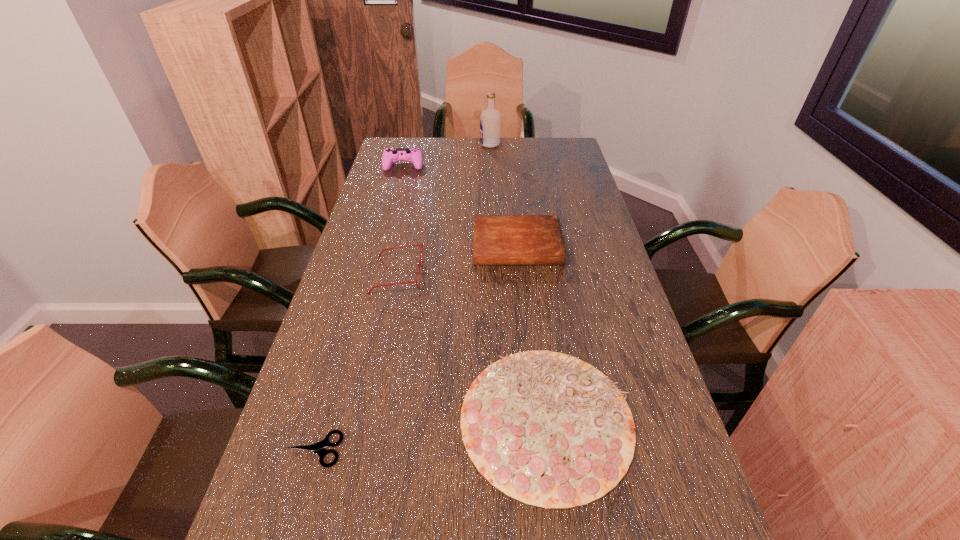
Find the location of `Bible at the right edge`. Bible at the right edge is located at coordinates (498, 239).

The width and height of the screenshot is (960, 540). Find the location of `pizza positioned at the right edge`. pizza positioned at the right edge is located at coordinates (548, 429).

The height and width of the screenshot is (540, 960). In order to click on object present at the far left corner in this screenshot , I will do `click(414, 155)`.

In order to click on vacant space at the far edge of the desktop in this screenshot , I will do `click(487, 149)`.

This screenshot has width=960, height=540. Find the location of `free spot at the left edge of the desktop`. free spot at the left edge of the desktop is located at coordinates (372, 309).

This screenshot has height=540, width=960. In order to click on vacant space at the right edge in this screenshot , I will do `click(569, 272)`.

At what (x,y) coordinates should I click in order to perform the action: click on free space at the far left corner. Please return your answer as a coordinate pair (x, y). The image size is (960, 540). Looking at the image, I should click on (410, 141).

At what (x,y) coordinates should I click in order to perform the action: click on free area in between the Bible and the pizza. Please return your answer as a coordinate pair (x, y). Image resolution: width=960 pixels, height=540 pixels. Looking at the image, I should click on (532, 332).

You are a GUI agent. You are given a task and a screenshot of the screen. Output one action in this format:
    pyautogui.click(x=<x>, y=<y>)
    Task: Click on the unoccupied area between the spectacles and the shears
    This screenshot has width=960, height=540.
    Given the screenshot: What is the action you would take?
    pyautogui.click(x=355, y=362)

You are a GUI agent. You are given a task and a screenshot of the screen. Output one action in this format:
    pyautogui.click(x=<x>, y=<y>)
    Task: Click on the free space that is in between the shortest object and the control
    This screenshot has width=960, height=540.
    Given the screenshot: What is the action you would take?
    pyautogui.click(x=359, y=308)